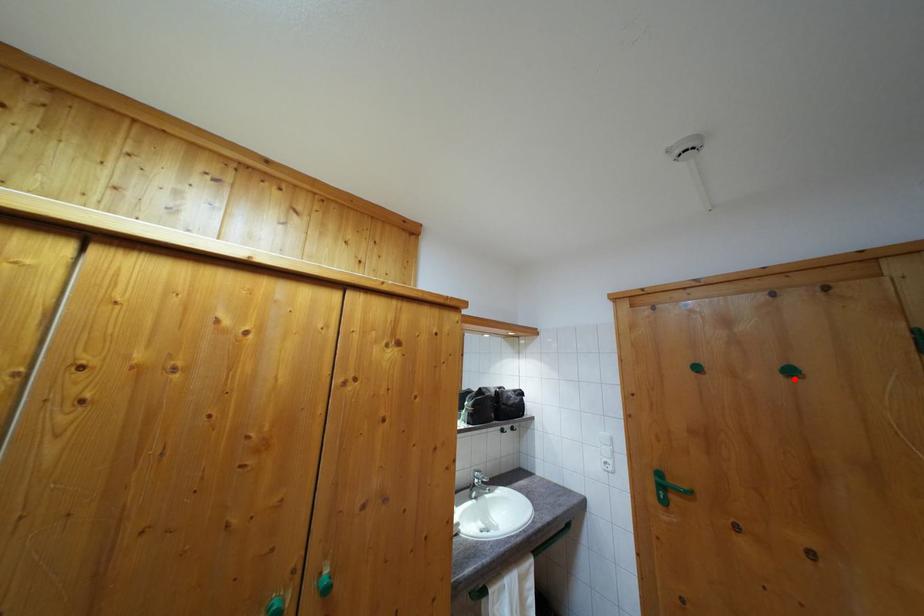
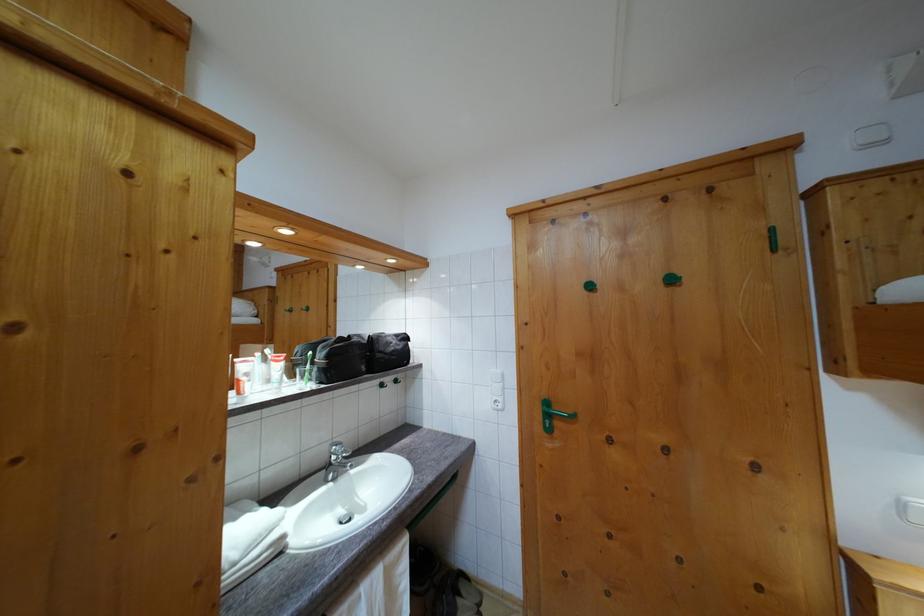
In the second image, find the point that corresponds to the highlighted location in the first image.

(675, 286)